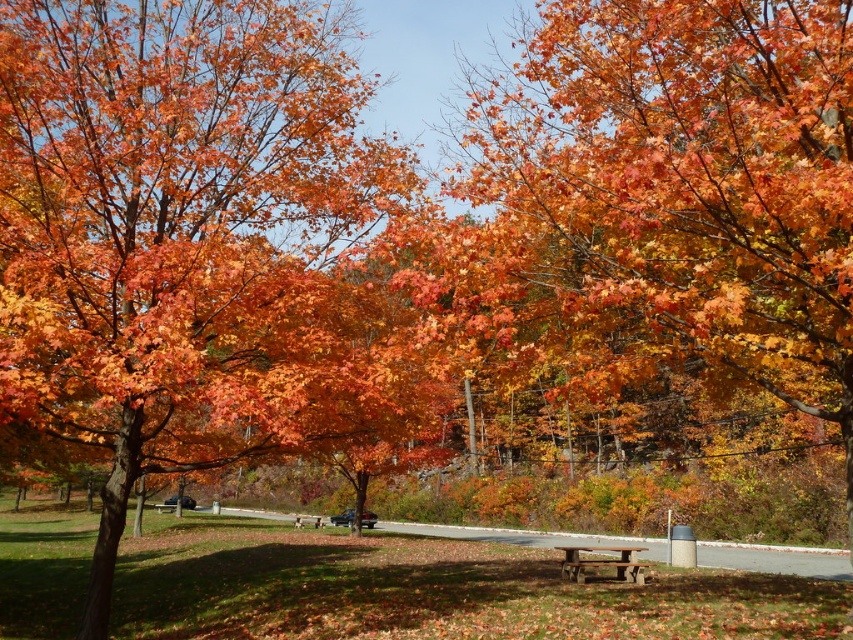
Who is lower down, orange autumn leaves at center or rustic wood picnic table at center?

rustic wood picnic table at center is below.

What do you see at coordinates (683, 186) in the screenshot? This screenshot has height=640, width=853. I see `orange autumn leaves at center` at bounding box center [683, 186].

The height and width of the screenshot is (640, 853). What are the coordinates of `orange autumn leaves at center` in the screenshot? It's located at (683, 186).

Identify the location of orange autumn leaves at center. The height and width of the screenshot is (640, 853). (683, 186).